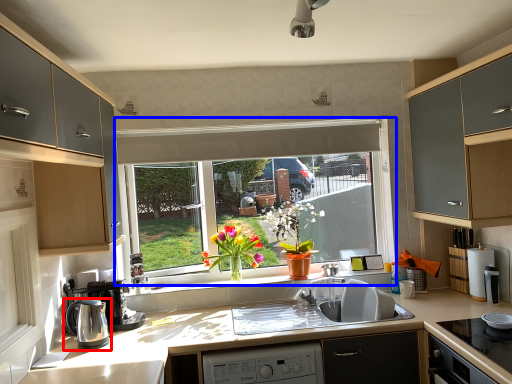
Question: Which object appears closest to the camera in this image, kitchen appliance (highlighted by a red box) or window (highlighted by a blue box)?

Choices:
 (A) kitchen appliance
 (B) window

Answer: (A)